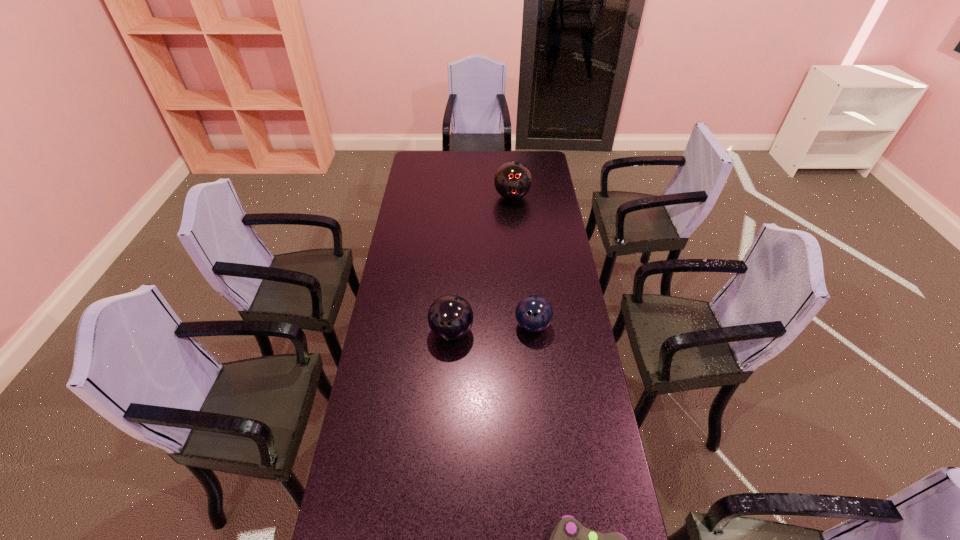
Identify the location of the farthest bowling ball. (513, 180).

This screenshot has height=540, width=960. Identify the location of the leftmost bowling ball. click(450, 317).

This screenshot has width=960, height=540. Find the location of `the shortest bowling ball`. the shortest bowling ball is located at coordinates (533, 313).

The height and width of the screenshot is (540, 960). I want to click on vacant region located 0.150m on the surface of the farthest object near the finger holes, so click(x=515, y=226).

This screenshot has width=960, height=540. Find the location of `free space located on the side of the leftmost object with the finger holes`. free space located on the side of the leftmost object with the finger holes is located at coordinates (450, 361).

The width and height of the screenshot is (960, 540). I want to click on vacant space positioned 0.280m on the surface of the second shortest object near the finger holes, so click(x=541, y=410).

Where is `free space at the far edge of the desktop`? free space at the far edge of the desktop is located at coordinates (469, 156).

In the image, there is a desktop. Where is `vacant space at the left edge`? vacant space at the left edge is located at coordinates (412, 199).

This screenshot has height=540, width=960. In the image, there is a desktop. Find the location of `vacant space at the right edge`. vacant space at the right edge is located at coordinates tap(541, 247).

In order to click on free spot between the farthest object and the leftmost object in this screenshot , I will do `click(482, 264)`.